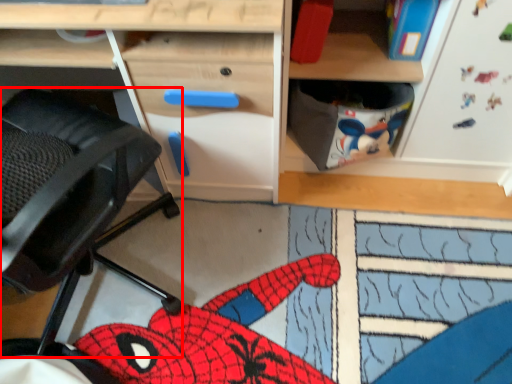
Question: From the image's perspective, considering the relative positions of swivel chair (annotated by the red box) and desk in the image provided, where is swivel chair (annotated by the red box) located with respect to the staircase?

Choices:
 (A) below
 (B) above

Answer: (A)